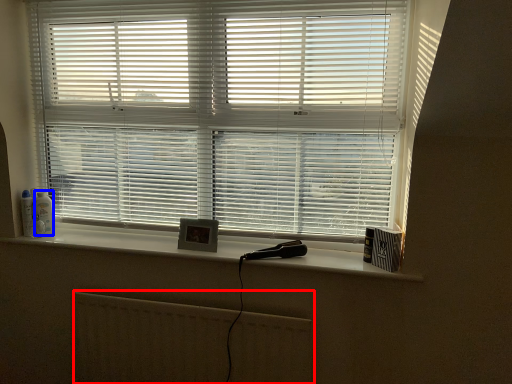
Question: Among these objects, which one is nearest to the camera, radiator (highlighted by a red box) or toiletry (highlighted by a blue box)?

Choices:
 (A) radiator
 (B) toiletry

Answer: (A)